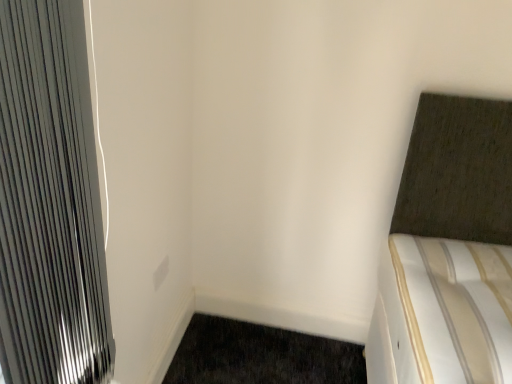
Question: From a real-world perspective, is metallic silver radiator at left over white matte electric outlet at center?

Choices:
 (A) no
 (B) yes

Answer: (B)

Question: Is metallic silver radiator at left not within white matte electric outlet at center?

Choices:
 (A) yes
 (B) no

Answer: (A)

Question: Considering the relative sizes of metallic silver radiator at left and white matte electric outlet at center in the image provided, is metallic silver radiator at left taller than white matte electric outlet at center?

Choices:
 (A) yes
 (B) no

Answer: (A)

Question: Is metallic silver radiator at left positioned with its back to white matte electric outlet at center?

Choices:
 (A) yes
 (B) no

Answer: (B)

Question: Can you confirm if metallic silver radiator at left is bigger than white matte electric outlet at center?

Choices:
 (A) yes
 (B) no

Answer: (A)

Question: Would you say metallic silver radiator at left is a long distance from white matte electric outlet at center?

Choices:
 (A) no
 (B) yes

Answer: (A)

Question: Is dark brown carpet at lower left outside of white matte electric outlet at center?

Choices:
 (A) no
 (B) yes

Answer: (B)

Question: Considering the relative positions of dark brown carpet at lower left and white matte electric outlet at center in the image provided, is dark brown carpet at lower left in front of white matte electric outlet at center?

Choices:
 (A) no
 (B) yes

Answer: (A)

Question: Does dark brown carpet at lower left have a lesser width compared to white matte electric outlet at center?

Choices:
 (A) no
 (B) yes

Answer: (A)

Question: Can you confirm if dark brown carpet at lower left is shorter than white matte electric outlet at center?

Choices:
 (A) yes
 (B) no

Answer: (A)

Question: From the image's perspective, is dark brown carpet at lower left located beneath white matte electric outlet at center?

Choices:
 (A) yes
 (B) no

Answer: (A)

Question: Is dark brown carpet at lower left to the right of white matte electric outlet at center from the viewer's perspective?

Choices:
 (A) yes
 (B) no

Answer: (A)

Question: Is dark brown carpet at lower left further to camera compared to metallic silver radiator at left?

Choices:
 (A) yes
 (B) no

Answer: (A)